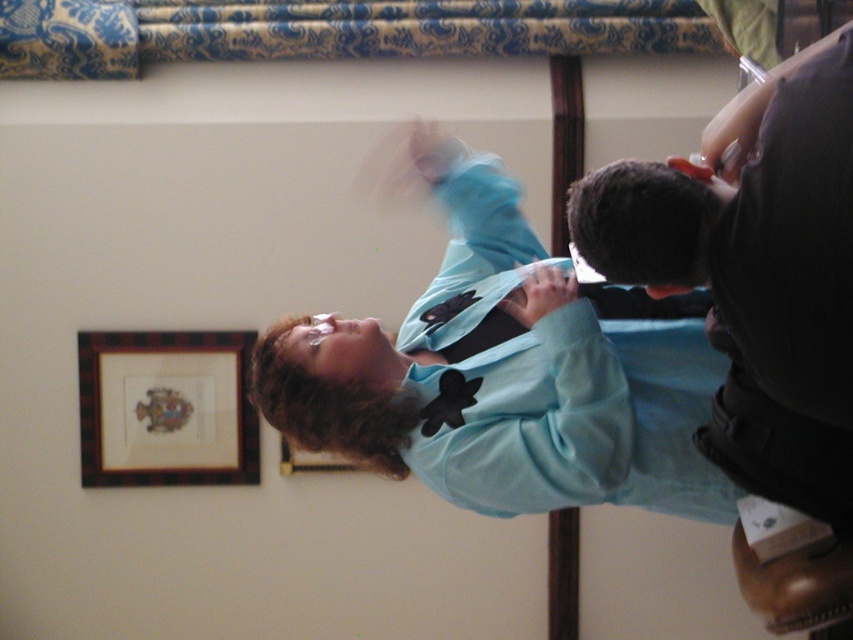
Does wooden picture frame at upper left appear on the right side of wooden plaque at center?

Incorrect, wooden picture frame at upper left is not on the right side of wooden plaque at center.

Does point (90, 460) come farther from viewer compared to point (306, 468)?

No, (90, 460) is in front of (306, 468).

Where is `wooden picture frame at upper left`? The image size is (853, 640). wooden picture frame at upper left is located at coordinates (165, 408).

Can you confirm if wooden picture frame at upper left is wider than black satin bow tie at center?

Yes, wooden picture frame at upper left is wider than black satin bow tie at center.

Identify the location of wooden picture frame at upper left. The image size is (853, 640). (165, 408).

Where is `wooden picture frame at upper left`? This screenshot has width=853, height=640. wooden picture frame at upper left is located at coordinates (165, 408).

Does black satin bow tie at center have a smaller size compared to wooden plaque at center?

Yes.

Is black satin bow tie at center bigger than wooden plaque at center?

Incorrect, black satin bow tie at center is not larger than wooden plaque at center.

The image size is (853, 640). Identify the location of black satin bow tie at center. (448, 401).

This screenshot has width=853, height=640. I want to click on black satin bow tie at center, so click(448, 401).